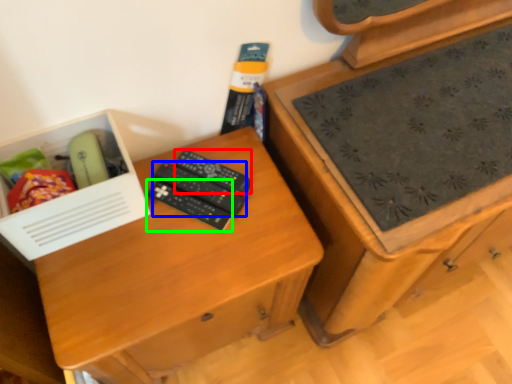
Question: Which is nearer to the remote control (highlighted by a red box)? remote control (highlighted by a blue box) or remote control (highlighted by a green box).

Choices:
 (A) remote control
 (B) remote control

Answer: (A)